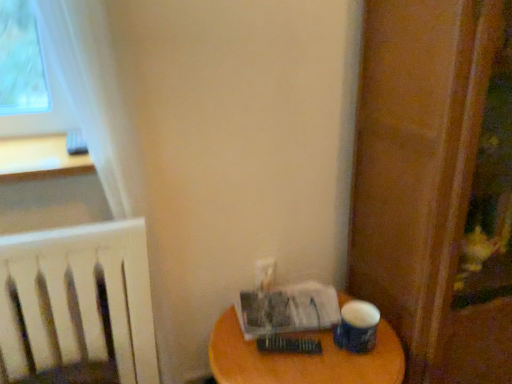
What do you see at coordinates (288, 309) in the screenshot?
I see `white paper at lower right, arranged as the 2th paperback book when viewed from the front` at bounding box center [288, 309].

Measure the distance between wooden screen door at right and camera.

wooden screen door at right and camera are 82.38 centimeters apart from each other.

What do you see at coordinates (478, 220) in the screenshot? This screenshot has height=384, width=512. I see `wooden screen door at right` at bounding box center [478, 220].

At what (x,y) coordinates should I click in order to perform the action: click on hardcover book at center, the 2th paperback book in the back-to-front sequence. Please return your answer as a coordinate pair (x, y). Looking at the image, I should click on (288, 345).

At what (x,y) coordinates should I click in order to perform the action: click on blue matte paper cup at lower right. Please return your answer as a coordinate pair (x, y). The height and width of the screenshot is (384, 512). Looking at the image, I should click on (357, 327).

What is the approximate width of blue matte paper cup at lower right?

The width of blue matte paper cup at lower right is 4.57 inches.

Describe the element at coordinates (302, 358) in the screenshot. I see `wooden table at lower right` at that location.

You are a GUI agent. You are given a task and a screenshot of the screen. Output one action in this format:
    pyautogui.click(x=<x>, y=<y>)
    Task: Click on the white paper at lower right, arranged as the 2th paperback book when viewed from the front
    This screenshot has width=512, height=384.
    Given the screenshot: What is the action you would take?
    pyautogui.click(x=288, y=309)

Could you tell me if hardcover book at center, marked as the first paperback book in a front-to-back arrangement, is facing wooden table at lower right?

No, hardcover book at center, marked as the first paperback book in a front-to-back arrangement, is not oriented towards wooden table at lower right.

Considering the points (297, 350) and (231, 329), which point is behind, point (297, 350) or point (231, 329)?

The point (231, 329) is farther.

Is hardcover book at center, the 2th paperback book in the back-to-front sequence, inside the boundaries of wooden table at lower right, or outside?

hardcover book at center, the 2th paperback book in the back-to-front sequence, is spatially situated outside wooden table at lower right.

From a real-world perspective, is hardcover book at center, marked as the first paperback book in a front-to-back arrangement, positioned above or below wooden table at lower right?

hardcover book at center, marked as the first paperback book in a front-to-back arrangement, is situated higher than wooden table at lower right in the real world.

Between blue matte paper cup at lower right and hardcover book at center, marked as the first paperback book in a front-to-back arrangement, which one has larger size?

blue matte paper cup at lower right is bigger.

From a real-world perspective, is blue matte paper cup at lower right positioned above or below hardcover book at center, marked as the first paperback book in a front-to-back arrangement?

blue matte paper cup at lower right is above hardcover book at center, marked as the first paperback book in a front-to-back arrangement.

Considering the relative sizes of blue matte paper cup at lower right and hardcover book at center, marked as the first paperback book in a front-to-back arrangement, in the image provided, is blue matte paper cup at lower right taller than hardcover book at center, marked as the first paperback book in a front-to-back arrangement,?

Correct, blue matte paper cup at lower right is much taller as hardcover book at center, marked as the first paperback book in a front-to-back arrangement.

Is blue matte paper cup at lower right wider than hardcover book at center, marked as the first paperback book in a front-to-back arrangement?

Yes, blue matte paper cup at lower right is wider than hardcover book at center, marked as the first paperback book in a front-to-back arrangement.

Identify the location of the 2nd paperback book behind the blue matte paper cup at lower right. (288, 309).

Is the position of white paper at lower right, arranged as the 2th paperback book when viewed from the front, more distant than that of blue matte paper cup at lower right?

Yes, it is behind blue matte paper cup at lower right.

In terms of size, does white paper at lower right, arranged as the 2th paperback book when viewed from the front, appear bigger or smaller than blue matte paper cup at lower right?

Clearly, white paper at lower right, arranged as the 2th paperback book when viewed from the front, is larger in size than blue matte paper cup at lower right.

Based on the photo, which is closer to the camera, (275, 298) or (372, 306)?

Point (275, 298) appears to be farther away from the viewer than point (372, 306).

You are a GUI agent. You are given a task and a screenshot of the screen. Output one action in this format:
    pyautogui.click(x=<x>, y=<y>)
    Task: Click on the paper cup behind the wooden screen door at right
    The image size is (512, 384).
    Given the screenshot: What is the action you would take?
    pyautogui.click(x=357, y=327)

Considering the sizes of objects blue matte paper cup at lower right and wooden screen door at right in the image provided, who is bigger, blue matte paper cup at lower right or wooden screen door at right?

wooden screen door at right.

Is blue matte paper cup at lower right closer to the viewer compared to wooden screen door at right?

That is False.

Which of these two, hardcover book at center, marked as the first paperback book in a front-to-back arrangement, or blue matte paper cup at lower right, stands shorter?

With less height is hardcover book at center, marked as the first paperback book in a front-to-back arrangement.

From the image's perspective, which one is positioned higher, hardcover book at center, the 2th paperback book in the back-to-front sequence, or blue matte paper cup at lower right?

blue matte paper cup at lower right appears higher in the image.

From the picture: Considering the sizes of objects hardcover book at center, marked as the first paperback book in a front-to-back arrangement, and blue matte paper cup at lower right in the image provided, who is bigger, hardcover book at center, marked as the first paperback book in a front-to-back arrangement, or blue matte paper cup at lower right?

blue matte paper cup at lower right is bigger.

From a real-world perspective, does hardcover book at center, marked as the first paperback book in a front-to-back arrangement, sit lower than blue matte paper cup at lower right?

Yes, from a real-world perspective, hardcover book at center, marked as the first paperback book in a front-to-back arrangement, is below blue matte paper cup at lower right.

Is wooden table at lower right shorter than white paper at lower right, arranged as the 2th paperback book when viewed from the front?

Incorrect, the height of wooden table at lower right does not fall short of that of white paper at lower right, arranged as the 2th paperback book when viewed from the front.

Is wooden table at lower right turned away from white paper at lower right, positioned as the first paperback book in back-to-front order?

No, white paper at lower right, positioned as the first paperback book in back-to-front order, is not at the back of wooden table at lower right.

Which object is wider, wooden table at lower right or white paper at lower right, positioned as the first paperback book in back-to-front order?

With larger width is wooden table at lower right.

Is wooden screen door at right facing towards wooden table at lower right?

No, wooden screen door at right is not facing towards wooden table at lower right.

From the image's perspective, is wooden screen door at right located above wooden table at lower right?

Indeed, from the image's perspective, wooden screen door at right is shown above wooden table at lower right.

From a real-world perspective, which object stands above the other?

wooden screen door at right.

Would you say wooden screen door at right is to the left or to the right of wooden table at lower right in the picture?

Clearly, wooden screen door at right is on the right of wooden table at lower right in the image.

Which paperback book is the 1st one when counting from the back of the wooden table at lower right? Please provide its 2D coordinates.

[(288, 345)]

In order to click on paperback book that is the 1st object to the left of the blue matte paper cup at lower right, starting at the anchor in this screenshot , I will do 288,345.

From the image, which object appears to be farther from wooden table at lower right, hardcover book at center, the 2th paperback book in the back-to-front sequence, or wooden screen door at right?

wooden screen door at right is further to wooden table at lower right.

Estimate the real-world distances between objects in this image. Which object is further from hardcover book at center, the 2th paperback book in the back-to-front sequence, blue matte paper cup at lower right or wooden table at lower right?

blue matte paper cup at lower right is positioned further to the anchor hardcover book at center, the 2th paperback book in the back-to-front sequence.

Looking at the image, which one is located further to hardcover book at center, the 2th paperback book in the back-to-front sequence, wooden table at lower right or wooden screen door at right?

Based on the image, wooden screen door at right appears to be further to hardcover book at center, the 2th paperback book in the back-to-front sequence.

From the image, which object appears to be farther from blue matte paper cup at lower right, wooden table at lower right or white paper at lower right, positioned as the first paperback book in back-to-front order?

The object further to blue matte paper cup at lower right is white paper at lower right, positioned as the first paperback book in back-to-front order.

Based on their spatial positions, is wooden screen door at right or white paper at lower right, positioned as the first paperback book in back-to-front order, further from wooden table at lower right?

Based on the image, wooden screen door at right appears to be further to wooden table at lower right.

From the image, which object appears to be nearer to blue matte paper cup at lower right, white paper at lower right, arranged as the 2th paperback book when viewed from the front, or wooden table at lower right?

wooden table at lower right.

From the image, which object appears to be farther from white paper at lower right, arranged as the 2th paperback book when viewed from the front, wooden screen door at right or blue matte paper cup at lower right?

wooden screen door at right is further to white paper at lower right, arranged as the 2th paperback book when viewed from the front.

When comparing their distances from hardcover book at center, marked as the first paperback book in a front-to-back arrangement, does white paper at lower right, positioned as the first paperback book in back-to-front order, or wooden table at lower right seem closer?

wooden table at lower right lies closer to hardcover book at center, marked as the first paperback book in a front-to-back arrangement, than the other object.

Locate an element on the screen. paper cup between white paper at lower right, positioned as the first paperback book in back-to-front order, and wooden table at lower right in the up-down direction is located at coordinates (357, 327).

Locate an element on the screen. paperback book between white paper at lower right, positioned as the first paperback book in back-to-front order, and wooden table at lower right vertically is located at coordinates (288, 345).

The image size is (512, 384). In order to click on table between white paper at lower right, arranged as the 2th paperback book when viewed from the front, and wooden screen door at right in this screenshot , I will do `click(302, 358)`.

At what (x,y) coordinates should I click in order to perform the action: click on paperback book between white paper at lower right, arranged as the 2th paperback book when viewed from the front, and wooden screen door at right, in the horizontal direction. Please return your answer as a coordinate pair (x, y). The width and height of the screenshot is (512, 384). Looking at the image, I should click on (288, 345).